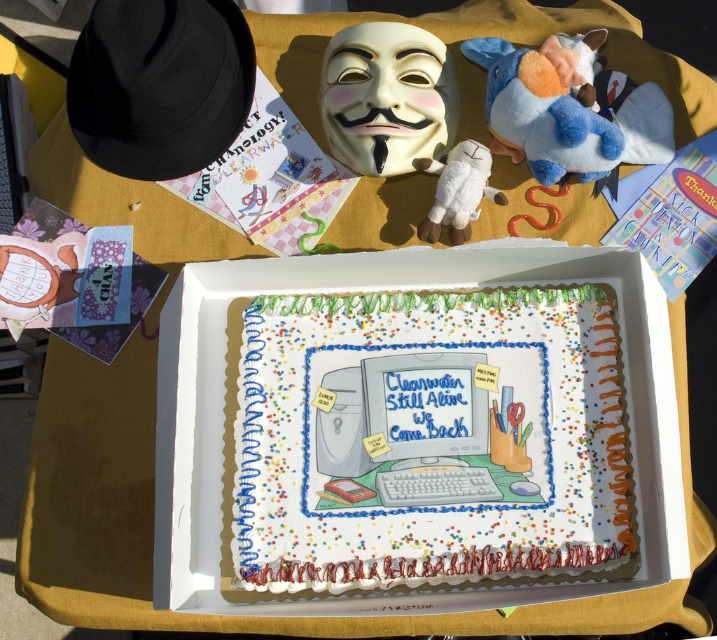
Between point (346, 586) and point (360, 49), which one is positioned behind?

Point (360, 49)

Based on the photo, measure the distance between white frosted sheet cake at center and white matte mask at upper center.

They are 7.45 inches apart.

This screenshot has height=640, width=717. What do you see at coordinates (427, 438) in the screenshot?
I see `white frosted sheet cake at center` at bounding box center [427, 438].

Locate an element on the screen. white frosted sheet cake at center is located at coordinates (427, 438).

Which is more to the left, white frosted sheet cake at center or blue plush toy at upper right?

Positioned to the left is white frosted sheet cake at center.

Locate an element on the screen. The image size is (717, 640). white frosted sheet cake at center is located at coordinates (427, 438).

Is white frosted sheet cake at center thinner than white plush toy at center?

No, white frosted sheet cake at center is not thinner than white plush toy at center.

Is white frosted sheet cake at center positioned in front of white plush toy at center?

Yes, it is.

Is point (460, 372) positioned after point (455, 243)?

No, it is not.

You are a GUI agent. You are given a task and a screenshot of the screen. Output one action in this format:
    pyautogui.click(x=<x>, y=<y>)
    Task: Click on the white frosted sheet cake at center
    The image size is (717, 640).
    Given the screenshot: What is the action you would take?
    pyautogui.click(x=427, y=438)